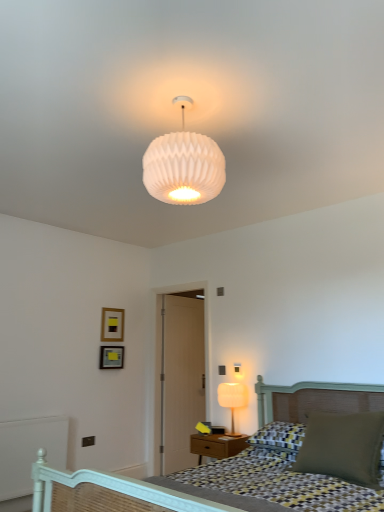
Question: From the image's perspective, is white ribbed glass lampshade at upper center, acting as the first lamp starting from the top, under matte black picture frame at upper left, which appears as the first picture frame when ordered from the bottom?

Choices:
 (A) no
 (B) yes

Answer: (A)

Question: Is white ribbed glass lampshade at upper center, the first lamp when ordered from front to back, bigger than matte black picture frame at upper left, which is counted as the second picture frame, starting from the top?

Choices:
 (A) no
 (B) yes

Answer: (B)

Question: Can we say white ribbed glass lampshade at upper center, the first lamp when ordered from front to back, lies outside matte black picture frame at upper left, which is counted as the second picture frame, starting from the top?

Choices:
 (A) yes
 (B) no

Answer: (A)

Question: Is the position of white ribbed glass lampshade at upper center, acting as the first lamp starting from the top, less distant than that of matte black picture frame at upper left, which appears as the first picture frame when ordered from the bottom?

Choices:
 (A) no
 (B) yes

Answer: (B)

Question: Does white ribbed glass lampshade at upper center, acting as the first lamp starting from the top, have a smaller size compared to matte black picture frame at upper left, which is counted as the second picture frame, starting from the top?

Choices:
 (A) no
 (B) yes

Answer: (A)

Question: Is checkered fabric bed at lower right taller or shorter than matte gold picture frame at upper left, the 1th picture frame viewed from the top?

Choices:
 (A) short
 (B) tall

Answer: (B)

Question: Looking at the image, does checkered fabric bed at lower right seem bigger or smaller compared to matte gold picture frame at upper left, the 1th picture frame viewed from the top?

Choices:
 (A) small
 (B) big

Answer: (B)

Question: Considering the positions of point pos(150,481) and point pos(102,331), is point pos(150,481) closer or farther from the camera than point pos(102,331)?

Choices:
 (A) farther
 (B) closer

Answer: (B)

Question: In the image, is checkered fabric bed at lower right positioned in front of or behind matte gold picture frame at upper left, the 1th picture frame viewed from the top?

Choices:
 (A) front
 (B) behind

Answer: (A)

Question: Is point (203, 445) positioned closer to the camera than point (107, 348)?

Choices:
 (A) farther
 (B) closer

Answer: (B)

Question: From a real-world perspective, is matte wood nightstand at lower center positioned above or below matte black picture frame at upper left, which appears as the first picture frame when ordered from the bottom?

Choices:
 (A) above
 (B) below

Answer: (B)

Question: Considering the relative positions of matte wood nightstand at lower center and matte black picture frame at upper left, which appears as the first picture frame when ordered from the bottom, in the image provided, is matte wood nightstand at lower center to the left or to the right of matte black picture frame at upper left, which appears as the first picture frame when ordered from the bottom,?

Choices:
 (A) left
 (B) right

Answer: (B)

Question: Considering the positions of matte wood nightstand at lower center and matte black picture frame at upper left, which is counted as the second picture frame, starting from the top, in the image, is matte wood nightstand at lower center taller or shorter than matte black picture frame at upper left, which is counted as the second picture frame, starting from the top,?

Choices:
 (A) short
 (B) tall

Answer: (B)

Question: Considering the positions of matte white lamp at right, the 1th lamp positioned from the right, and white painted wood balustrade at lower left in the image, is matte white lamp at right, the 1th lamp positioned from the right, taller or shorter than white painted wood balustrade at lower left?

Choices:
 (A) tall
 (B) short

Answer: (B)

Question: Considering the relative positions of matte white lamp at right, placed as the 2th lamp when sorted from front to back, and white painted wood balustrade at lower left in the image provided, is matte white lamp at right, placed as the 2th lamp when sorted from front to back, to the left or to the right of white painted wood balustrade at lower left?

Choices:
 (A) right
 (B) left

Answer: (A)